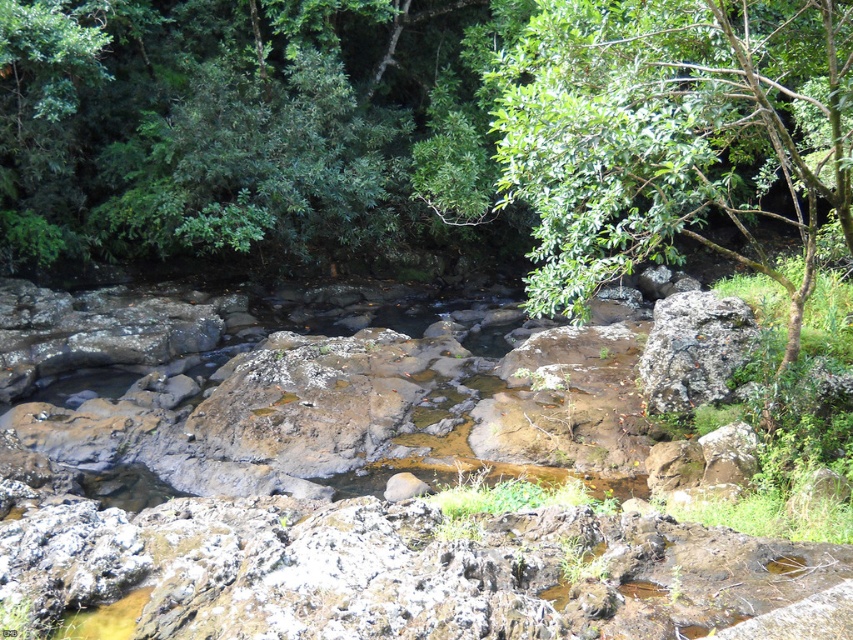
You are a hiker carrying a backpack and need to cross the stream. You see the green leafy tree at upper right and the rusty metallic boulder at right. Which object is closer to your current position if you are standing on the large rocks in the foreground?

The rusty metallic boulder at right is closer to your current position because it is only 2.94 meters away from the green leafy tree at upper right, but since you are on the large rocks in the foreground, the boulder is nearer than the tree.

You are a hiker trying to cross the stream using the rocks. You see the green leafy tree at upper right and the rusty metallic boulder at right. Which object is closer to the water surface?

The rusty metallic boulder at right is closer to the water surface because the green leafy tree at upper right is positioned over it, meaning the tree is higher up and the boulder is lower.

From the picture: You are a hiker trying to take a photo of the rusty metallic boulder at right without the green leafy tree at upper right blocking the view. Based on the scene, can you position yourself in a way to achieve this?

The green leafy tree at upper right is in front of the rusty metallic boulder at right, so you need to move to a position where the tree is no longer between you and the boulder. Moving to the left side of the scene might allow you to see the rusty metallic boulder at right without the obstruction of the green leafy tree at upper right.